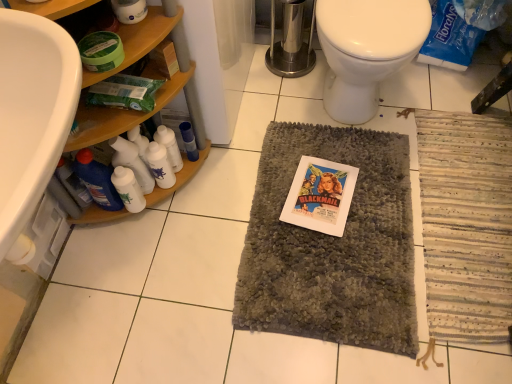
Where is `vacant space behind striped fabric bath mat at lower right`? Image resolution: width=512 pixels, height=384 pixels. vacant space behind striped fabric bath mat at lower right is located at coordinates (398, 109).